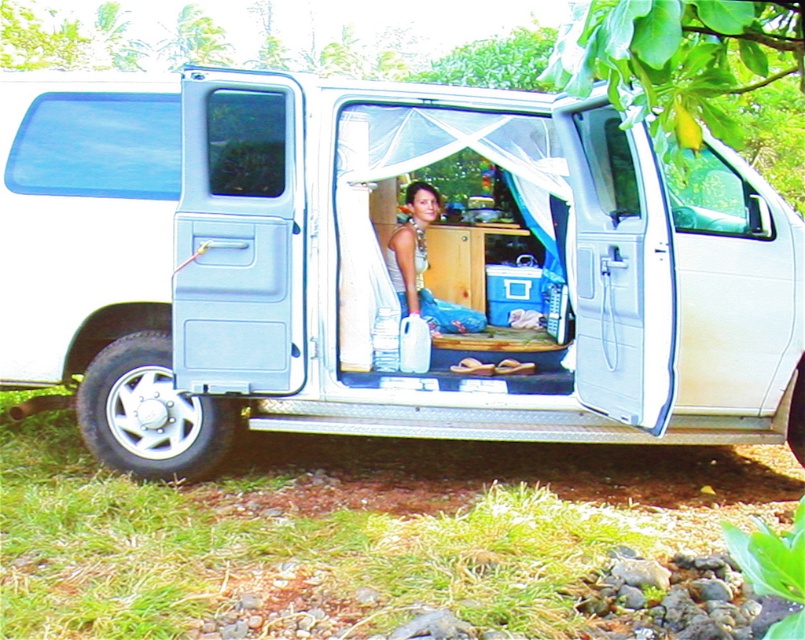
You are a delivery person trying to load a large package into the white matte van at center. The package is too big to fit through the light blue plastic door at center. What should you do?

The white matte van at center has a larger size compared to light blue plastic door at center, so you should consider using the larger opening or another entrance to load the package instead of the light blue plastic door at center.

You are standing outside the open door of the white van and want to reach both the point at coordinates (300, 392) and the point at (649, 429) inside the van. Which point should you approach first to reach the one closer to you?

You should approach point (300, 392) first because it is closer to you than point (649, 429), which is further away.

You are a delivery person trying to load a tall package into the white matte van at center. The package is taller than the white plastic door at right. Can you fit the package inside the van through the door?

The white matte van at center is much taller than the white plastic door at right, so the package taller than the door can fit inside the van through the door since the van is taller than the door.